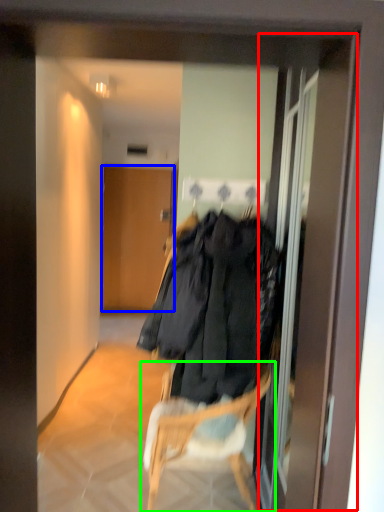
Question: Considering the real-world distances, which object is closest to screen door (highlighted by a red box)? door (highlighted by a blue box) or chair (highlighted by a green box).

Choices:
 (A) door
 (B) chair

Answer: (B)